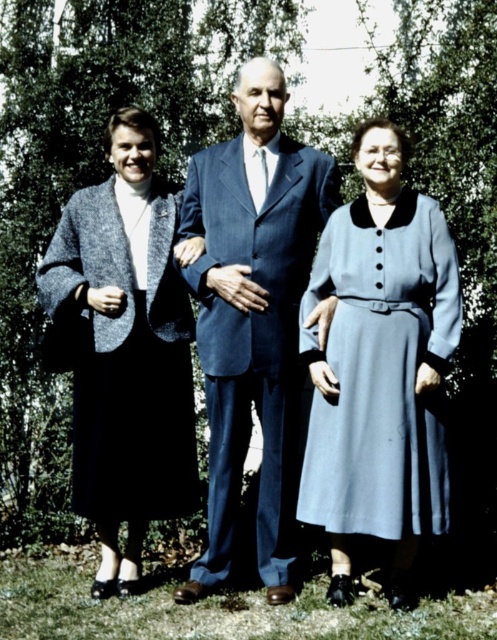
The image size is (497, 640). Find the location of `blue fabric suit at center`. blue fabric suit at center is located at coordinates (252, 317).

Does blue fabric suit at center appear on the left side of light blue fabric dress at center?

Yes, blue fabric suit at center is to the left of light blue fabric dress at center.

Between point (175, 592) and point (424, 227), which one is positioned behind?

The point (175, 592) is behind.

This screenshot has height=640, width=497. Find the location of `blue fabric suit at center`. blue fabric suit at center is located at coordinates (252, 317).

Does matte gray coat at left have a greater height compared to light blue fabric dress at center?

Correct, matte gray coat at left is much taller as light blue fabric dress at center.

Who is more forward, (113, 428) or (358, 364)?

Point (358, 364) is more forward.

Locate an element on the screen. matte gray coat at left is located at coordinates (127, 348).

Is matte blue suit at center positioned behind matte gray coat at left?

No, matte blue suit at center is closer to the viewer.

Who is more distant from viewer, (278, 464) or (132, 253)?

Positioned behind is point (132, 253).

The width and height of the screenshot is (497, 640). I want to click on matte blue suit at center, so click(319, 342).